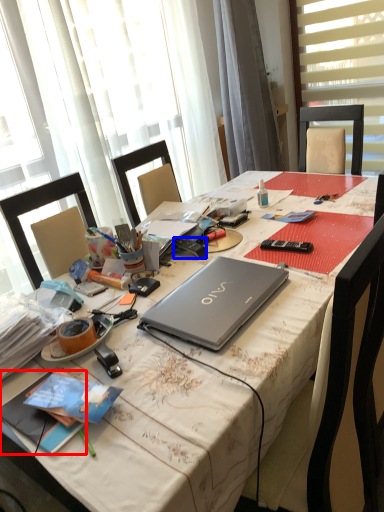
Question: Which of the following is the closest to the observer, book (highlighted by a red box) or remote control (highlighted by a blue box)?

Choices:
 (A) book
 (B) remote control

Answer: (A)